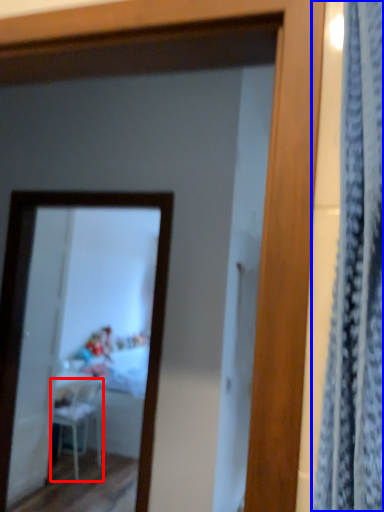
Question: Among these objects, which one is nearest to the camera, chair (highlighted by a red box) or curtain (highlighted by a blue box)?

Choices:
 (A) chair
 (B) curtain

Answer: (B)